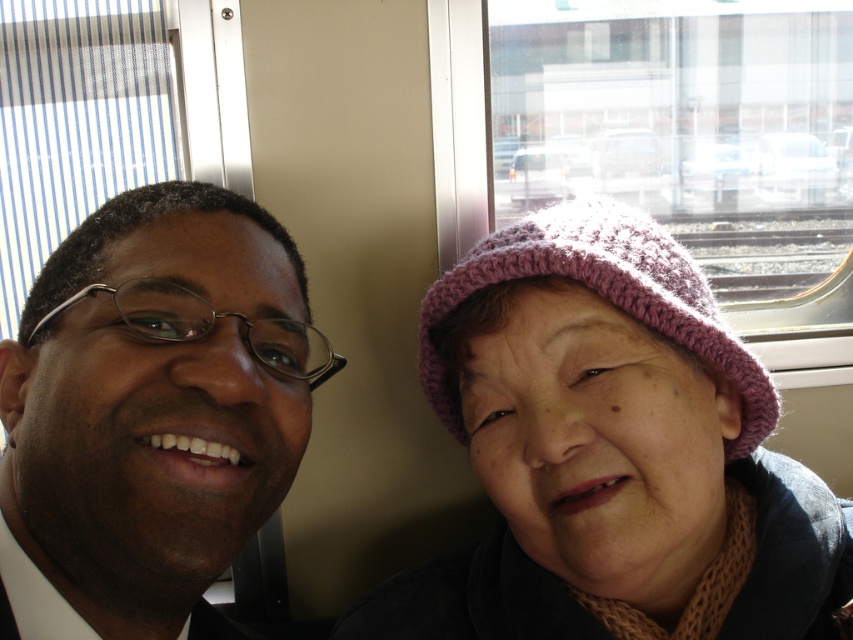
Question: Which object is the farthest from the knitted pink hat at right?

Choices:
 (A) matte black glasses at left
 (B) pink knitted hat at upper right

Answer: (A)

Question: Does matte black glasses at left lie behind pink knitted hat at upper right?

Choices:
 (A) no
 (B) yes

Answer: (A)

Question: Considering the real-world distances, which object is closest to the pink knitted hat at upper right?

Choices:
 (A) matte black glasses at left
 (B) knitted pink hat at right

Answer: (B)

Question: Is knitted pink hat at right wider than matte black glasses at left?

Choices:
 (A) no
 (B) yes

Answer: (B)

Question: Is knitted pink hat at right to the left of matte black glasses at left from the viewer's perspective?

Choices:
 (A) no
 (B) yes

Answer: (A)

Question: Which object appears closest to the camera in this image?

Choices:
 (A) matte black glasses at left
 (B) pink knitted hat at upper right
 (C) knitted pink hat at right

Answer: (A)